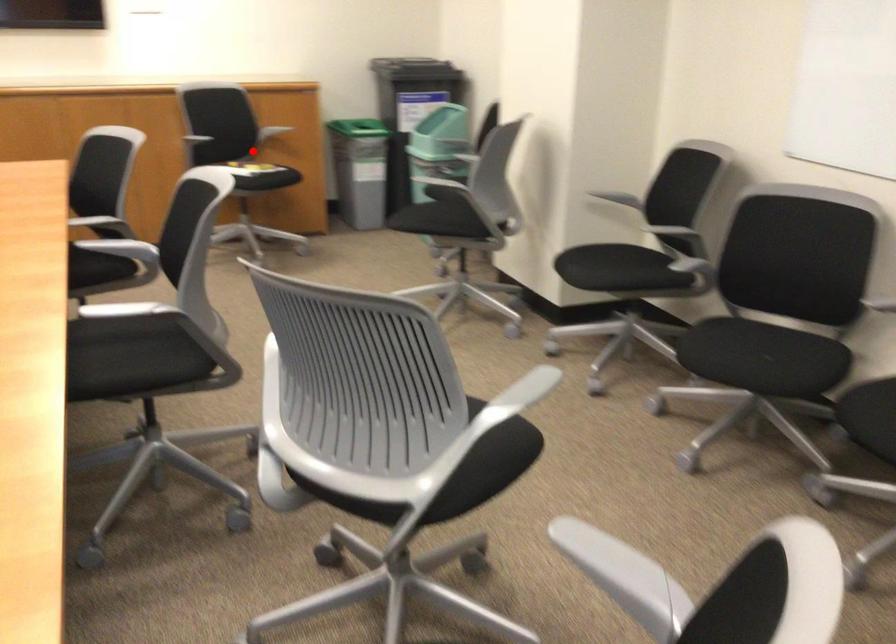
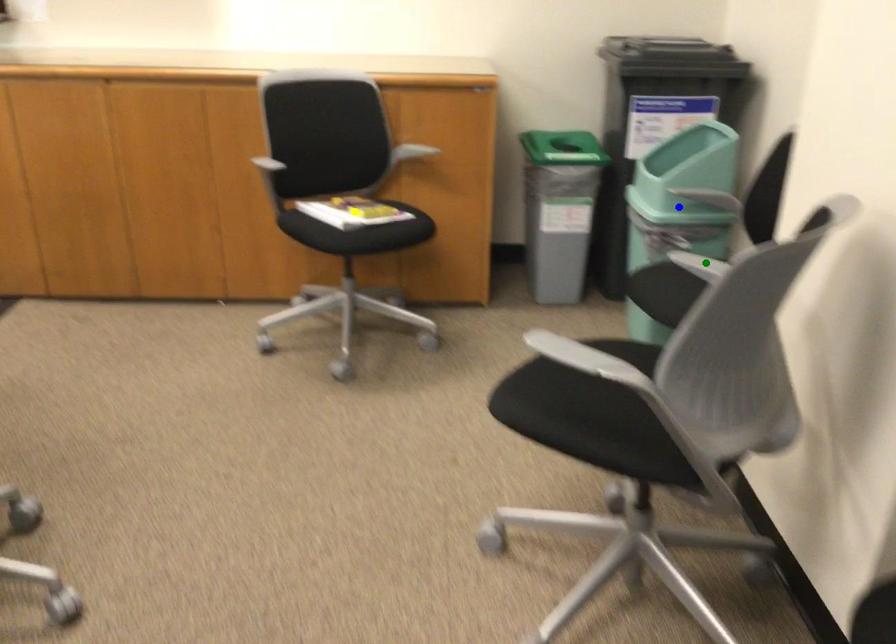
Question: I am providing you with two images of the same scene from different viewpoints. A red point is marked on the first image. You are given multiple points on the second image. In image 2, which mark is for the same physical point as the one in image 1?

Choices:
 (A) green point
 (B) blue point
 (C) yellow point

Answer: (C)